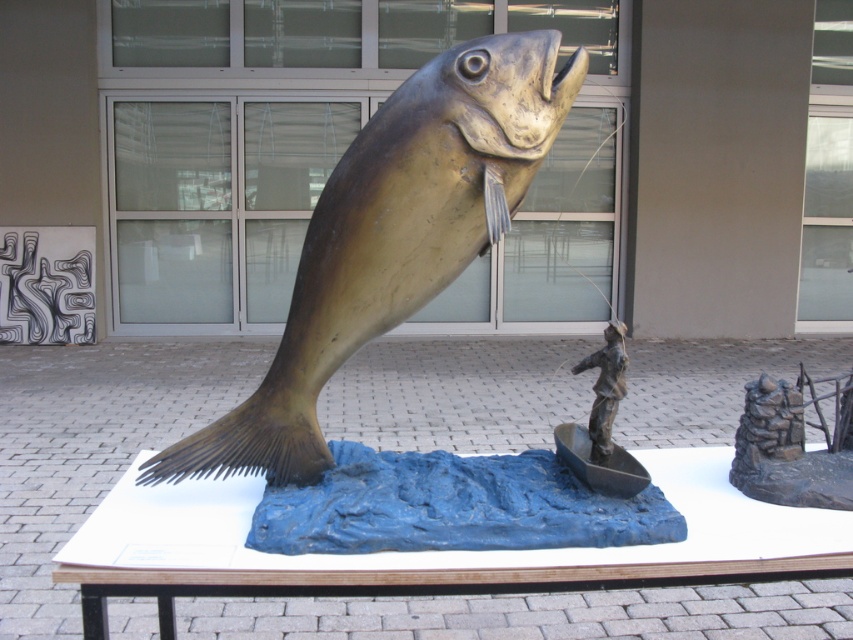
Question: Does gold-bronze fish at center appear on the right side of bronze fisherman in boat at center?

Choices:
 (A) no
 (B) yes

Answer: (A)

Question: Does rustic stone wall at center have a greater width compared to bronze fisherman in boat at center?

Choices:
 (A) yes
 (B) no

Answer: (A)

Question: Estimate the real-world distances between objects in this image. Which object is farther from the gold-bronze fish at center?

Choices:
 (A) rustic stone wall at center
 (B) bronze fisherman in boat at center

Answer: (A)

Question: Which object is the closest to the gold-bronze fish at center?

Choices:
 (A) bronze fisherman in boat at center
 (B) rustic stone wall at center

Answer: (A)

Question: Is gold-bronze fish at center bigger than rustic stone wall at center?

Choices:
 (A) yes
 (B) no

Answer: (A)

Question: Which point is closer to the camera taking this photo?

Choices:
 (A) (569, 440)
 (B) (302, 481)
 (C) (837, 476)

Answer: (B)